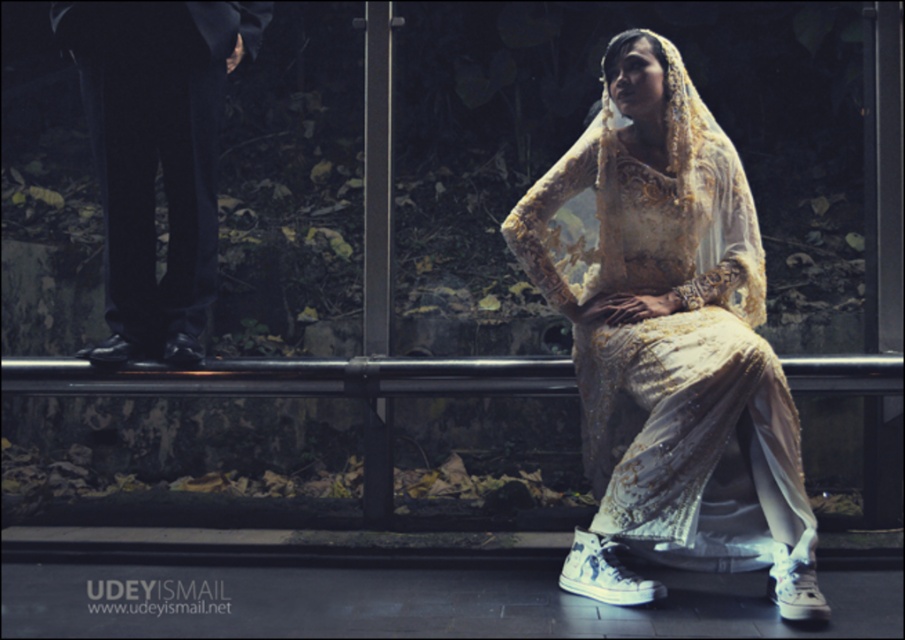
Question: Is matte gold lace dress at center bigger than black satin pants at left?

Choices:
 (A) yes
 (B) no

Answer: (A)

Question: Among these points, which one is farthest from the camera?

Choices:
 (A) (188, 161)
 (B) (805, 598)

Answer: (A)

Question: Which point appears farthest from the camera in this image?

Choices:
 (A) (156, 125)
 (B) (761, 388)

Answer: (A)

Question: Which of the following is the closest to the observer?

Choices:
 (A) matte gold lace dress at center
 (B) black satin pants at left

Answer: (A)

Question: Considering the relative positions of matte gold lace dress at center and black satin pants at left in the image provided, where is matte gold lace dress at center located with respect to black satin pants at left?

Choices:
 (A) above
 (B) below

Answer: (B)

Question: Is matte gold lace dress at center smaller than black satin pants at left?

Choices:
 (A) yes
 (B) no

Answer: (B)